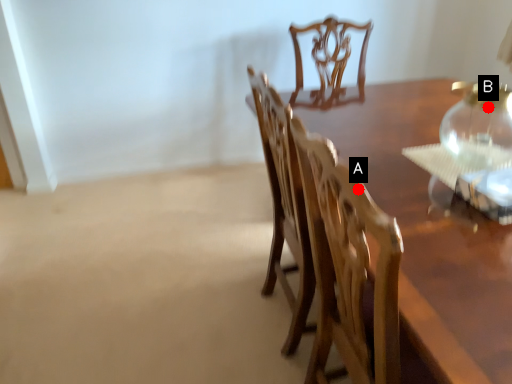
Question: Two points are circled on the image, labeled by A and B beside each circle. Which point is closer to the camera taking this photo?

Choices:
 (A) A is closer
 (B) B is closer

Answer: (A)